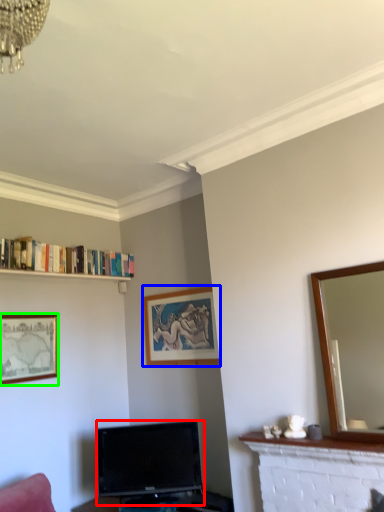
Question: Considering the real-world distances, which object is closest to television (highlighted by a red box)? picture frame (highlighted by a blue box) or picture frame (highlighted by a green box).

Choices:
 (A) picture frame
 (B) picture frame

Answer: (A)